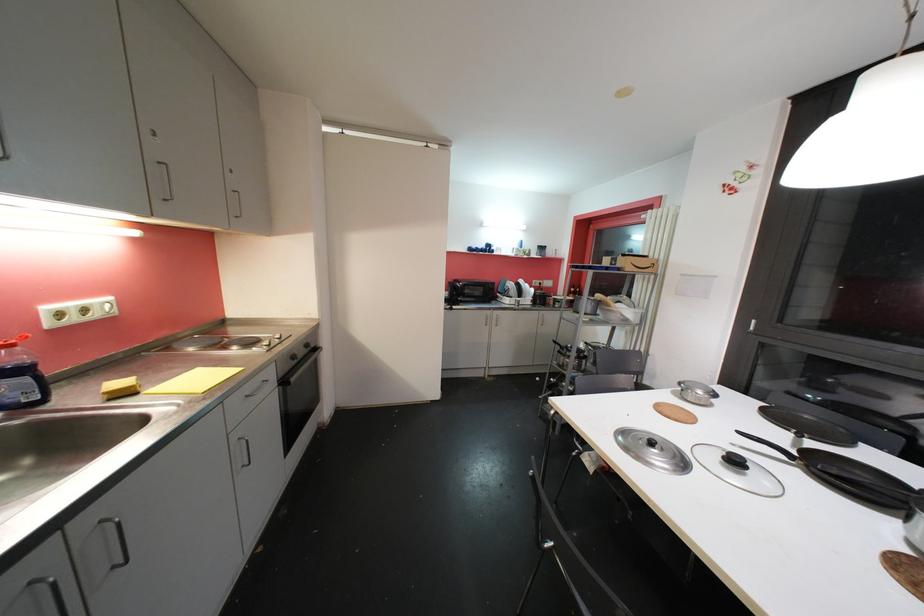
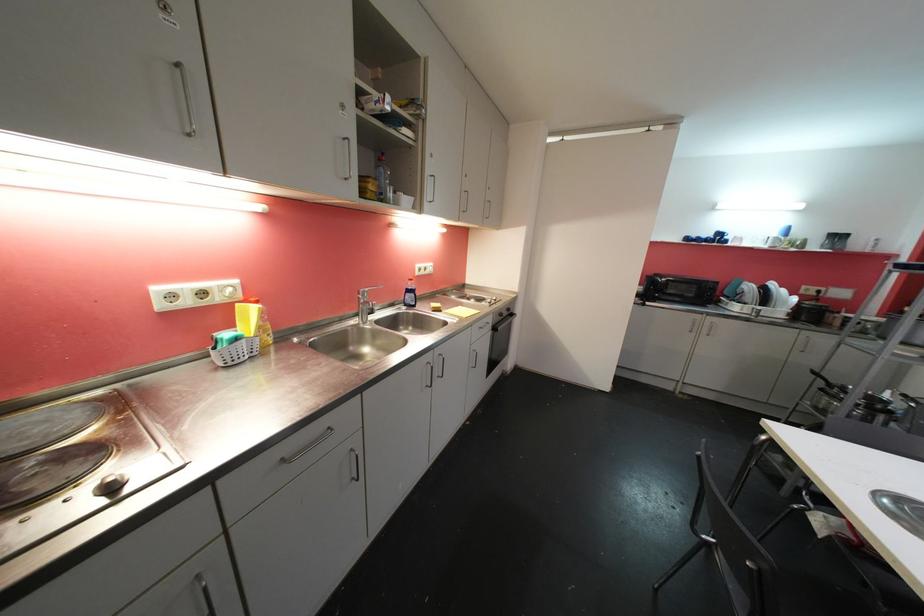
Find the pixel in the second image that matches the point at 521,248 in the first image.

(781, 236)